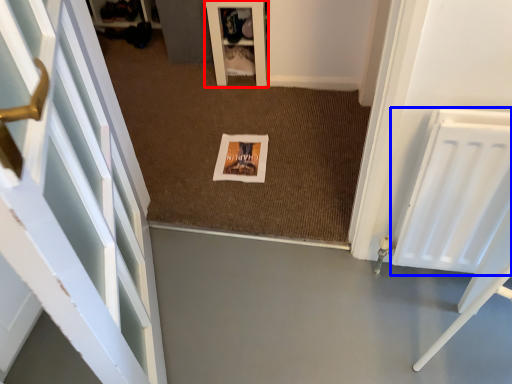
Question: Which object appears farthest to the camera in this image, furniture (highlighted by a red box) or radiator (highlighted by a blue box)?

Choices:
 (A) furniture
 (B) radiator

Answer: (A)